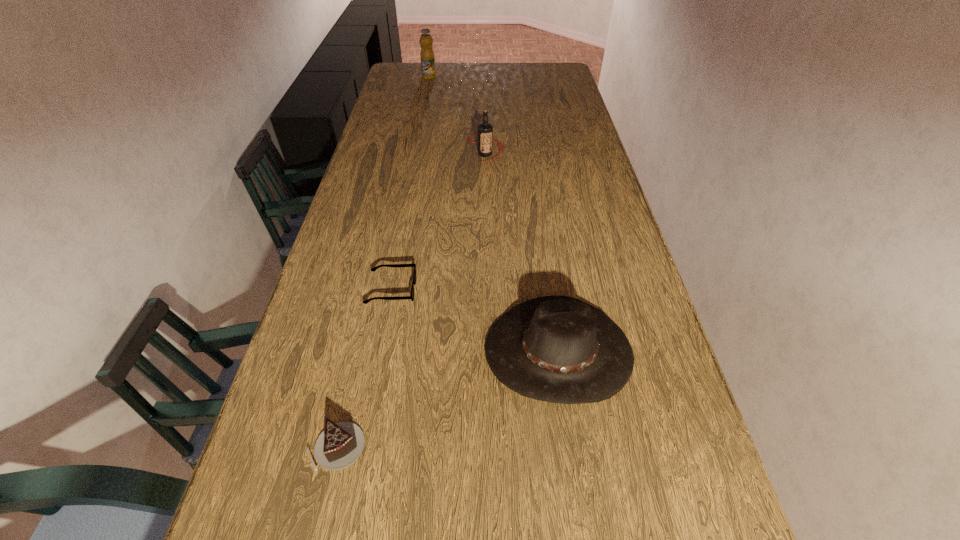
Identify the location of free space at the left edge of the desktop. This screenshot has width=960, height=540. (343, 276).

Locate an element on the screen. vacant region at the right edge of the desktop is located at coordinates (680, 512).

Find the location of `vacant area that lies between the second farthest object and the farthest object`. vacant area that lies between the second farthest object and the farthest object is located at coordinates (457, 116).

Identify the location of free space between the shortest object and the hat. (475, 321).

The height and width of the screenshot is (540, 960). I want to click on free space between the root beer and the shortest object, so click(439, 222).

Image resolution: width=960 pixels, height=540 pixels. I want to click on vacant region between the spectacles and the chocolate cake, so click(x=364, y=369).

The height and width of the screenshot is (540, 960). Identify the location of free space between the shortest object and the tallest object. (410, 184).

This screenshot has width=960, height=540. Identify the location of vacant region between the fourth shortest object and the third tallest object. (522, 252).

Locate an element on the screen. This screenshot has width=960, height=540. empty space between the spectacles and the fourth nearest object is located at coordinates (439, 222).

Locate an element on the screen. The image size is (960, 540). free space between the fruit juice and the second farthest object is located at coordinates (457, 116).